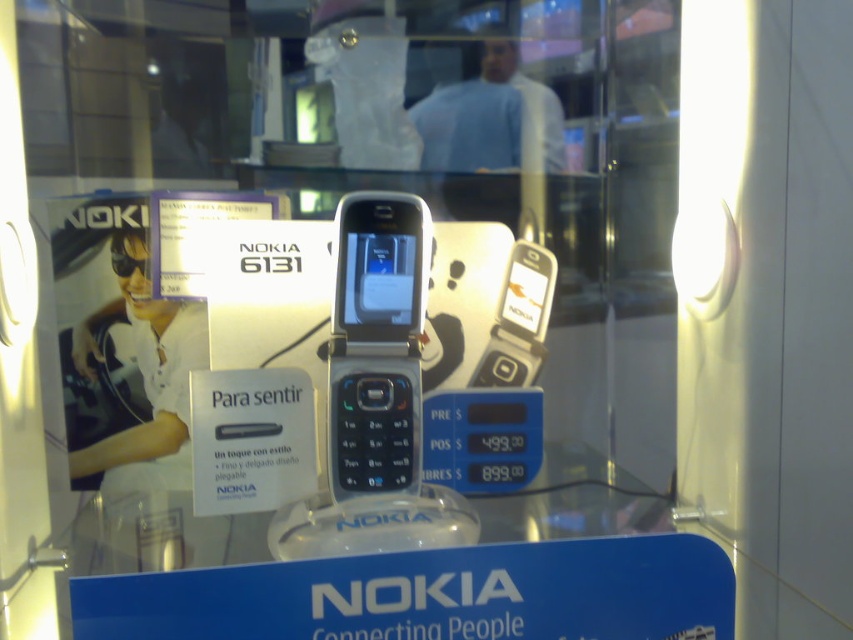
You are a customer in the store looking at the silver metallic phone at center and the transparent glass table at center. Which object is nearer to you?

The silver metallic phone at center is closer to the viewer than the transparent glass table at center.

You are a customer in a store looking at the silver metallic phone at center and the transparent glass table at center. Which object is wider?

The silver metallic phone at center is wider than the transparent glass table at center.